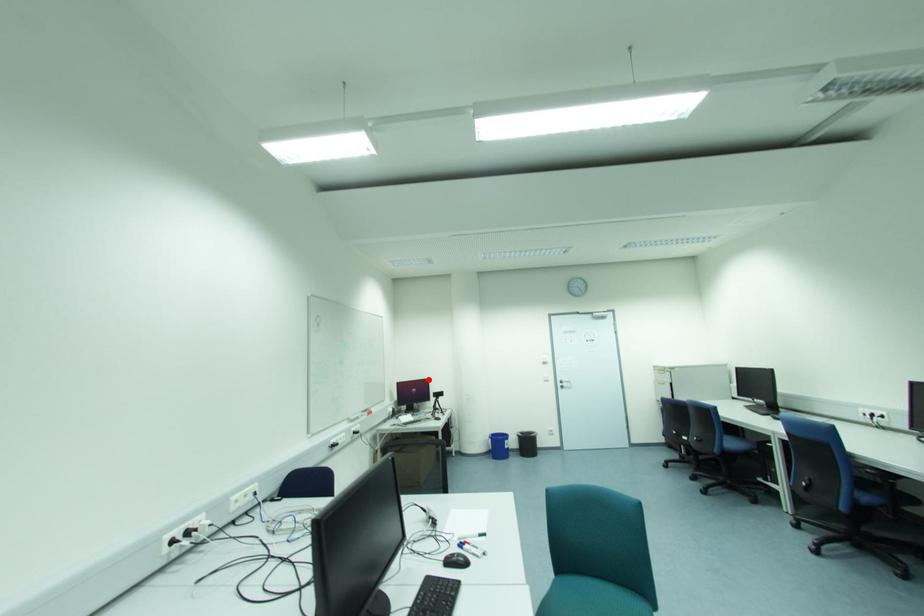
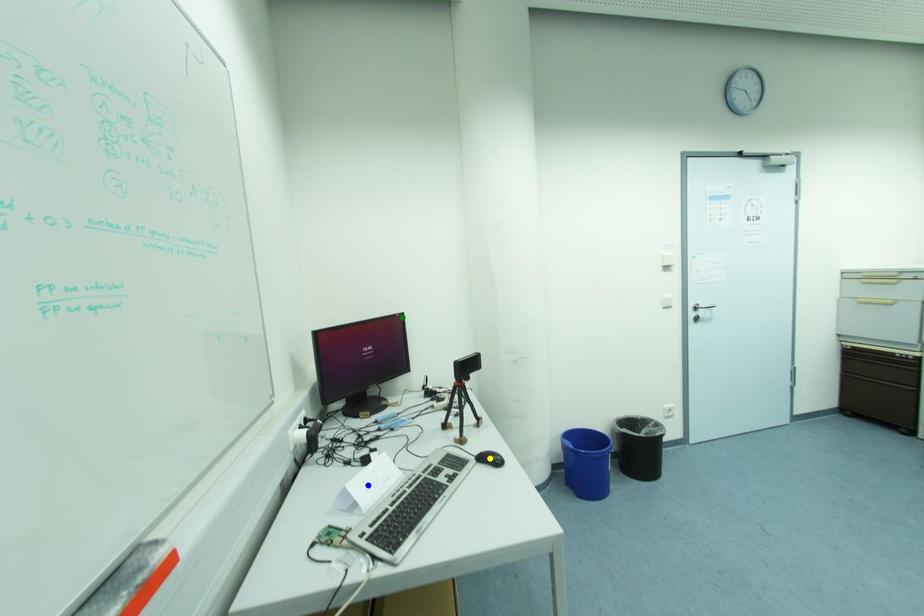
Question: I am providing you with two images of the same scene from different viewpoints. A red point is marked on the first image. You are given multiple points on the second image. Which mark in image 2 goes with the point in image 1?

Choices:
 (A) green point
 (B) yellow point
 (C) blue point

Answer: (A)